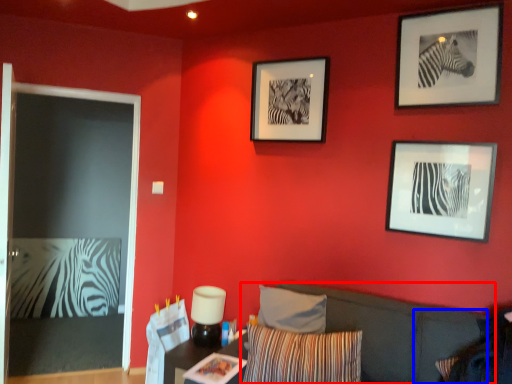
Question: Which of the following is the closest to the observer, couch (highlighted by a red box) or pillow (highlighted by a blue box)?

Choices:
 (A) couch
 (B) pillow

Answer: (A)